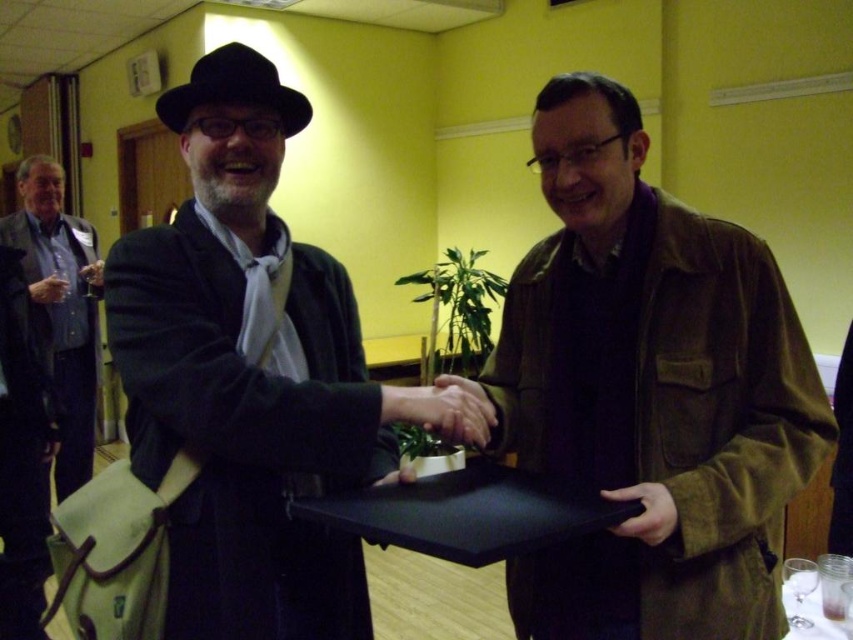
Question: Which of the following is the farthest from the observer?

Choices:
 (A) (33, 291)
 (B) (645, 499)
 (C) (480, 406)
 (D) (705, 557)

Answer: (A)

Question: Estimate the real-world distances between objects in this image. Which object is farther from the matte black hand at lower right?

Choices:
 (A) matte black hand at center
 (B) brushed metal tie at left
 (C) brown leather hand at center
 (D) brown suede jacket at center

Answer: (C)

Question: Is black matte coat at center positioned in front of brown leather hand at center?

Choices:
 (A) yes
 (B) no

Answer: (A)

Question: Considering the relative positions of brown suede jacket at center and brown leather hand at center in the image provided, where is brown suede jacket at center located with respect to brown leather hand at center?

Choices:
 (A) above
 (B) below

Answer: (B)

Question: Which point is closer to the camera taking this photo?

Choices:
 (A) (90, 355)
 (B) (485, 401)
 (C) (61, 291)

Answer: (B)

Question: From the image, what is the correct spatial relationship of matte black hand at lower right in relation to matte black hand at center?

Choices:
 (A) right
 (B) left

Answer: (A)